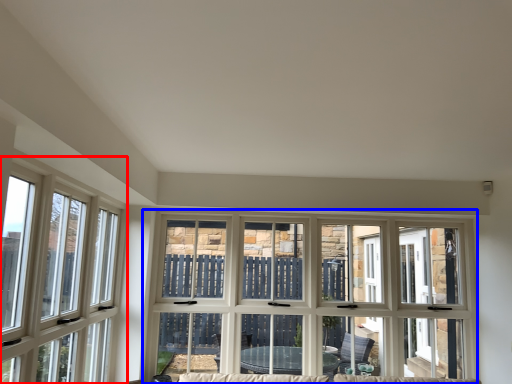
Question: Which point is further to the camera, window (highlighted by a red box) or window (highlighted by a blue box)?

Choices:
 (A) window
 (B) window

Answer: (B)